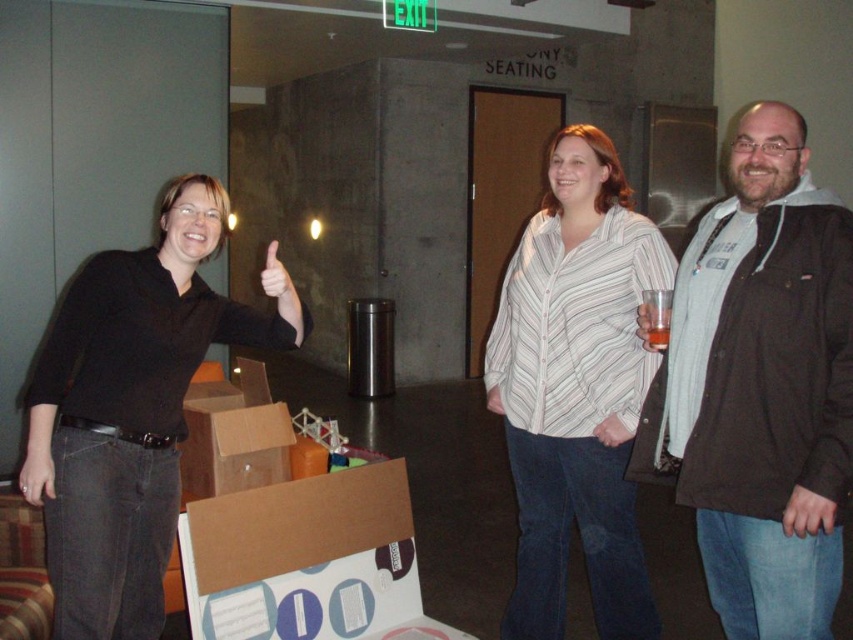
Question: Among these objects, which one is nearest to the camera?

Choices:
 (A) black matte shirt at left
 (B) white striped shirt at center
 (C) dark brown jacket at right
 (D) translucent plastic cup at right

Answer: (C)

Question: Among these objects, which one is farthest from the camera?

Choices:
 (A) dark brown jacket at right
 (B) white striped shirt at center
 (C) black matte shirt at left

Answer: (B)

Question: Can you confirm if black matte shirt at left is positioned to the left of translucent plastic cup at right?

Choices:
 (A) yes
 (B) no

Answer: (A)

Question: Among these points, which one is farthest from the camera?

Choices:
 (A) (766, 502)
 (B) (584, 323)

Answer: (B)

Question: Does black matte shirt at left have a lesser width compared to white striped shirt at center?

Choices:
 (A) no
 (B) yes

Answer: (A)

Question: Is dark brown jacket at right wider than black matte shirt at left?

Choices:
 (A) yes
 (B) no

Answer: (B)